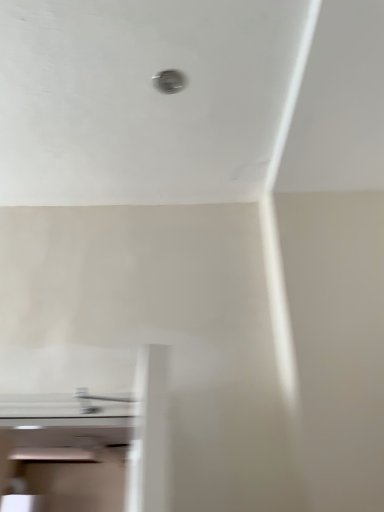
Question: From the image's perspective, is metallic circular hole at upper center located above satin nickel faucet at lower center?

Choices:
 (A) no
 (B) yes

Answer: (B)

Question: Is metallic circular hole at upper center turned away from satin nickel faucet at lower center?

Choices:
 (A) no
 (B) yes

Answer: (A)

Question: Is metallic circular hole at upper center further to the viewer compared to satin nickel faucet at lower center?

Choices:
 (A) yes
 (B) no

Answer: (A)

Question: Is metallic circular hole at upper center taller than satin nickel faucet at lower center?

Choices:
 (A) no
 (B) yes

Answer: (A)

Question: Does metallic circular hole at upper center have a smaller size compared to satin nickel faucet at lower center?

Choices:
 (A) no
 (B) yes

Answer: (B)

Question: From a real-world perspective, is metallic circular hole at upper center over satin nickel faucet at lower center?

Choices:
 (A) no
 (B) yes

Answer: (B)

Question: From a real-world perspective, is satin nickel faucet at lower center located higher than metallic circular hole at upper center?

Choices:
 (A) yes
 (B) no

Answer: (B)

Question: Is satin nickel faucet at lower center positioned far away from metallic circular hole at upper center?

Choices:
 (A) no
 (B) yes

Answer: (B)

Question: Can you confirm if satin nickel faucet at lower center is wider than metallic circular hole at upper center?

Choices:
 (A) yes
 (B) no

Answer: (A)

Question: Is satin nickel faucet at lower center thinner than metallic circular hole at upper center?

Choices:
 (A) no
 (B) yes

Answer: (A)

Question: Is satin nickel faucet at lower center positioned before metallic circular hole at upper center?

Choices:
 (A) yes
 (B) no

Answer: (A)

Question: Can you confirm if satin nickel faucet at lower center is positioned to the right of metallic circular hole at upper center?

Choices:
 (A) no
 (B) yes

Answer: (A)

Question: Relative to metallic circular hole at upper center, is satin nickel faucet at lower center in front or behind?

Choices:
 (A) behind
 (B) front

Answer: (B)